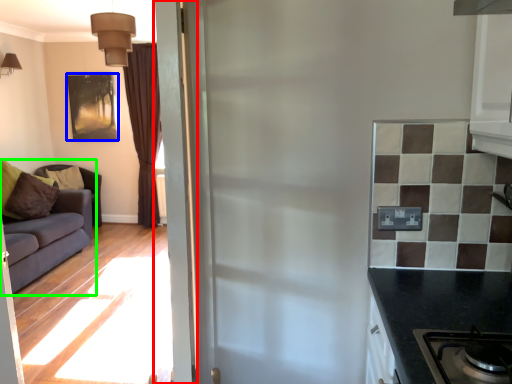
Question: Which object is the farthest from door (highlighted by a red box)? Choose among these: picture frame (highlighted by a blue box) or studio couch (highlighted by a green box).

Choices:
 (A) picture frame
 (B) studio couch

Answer: (A)